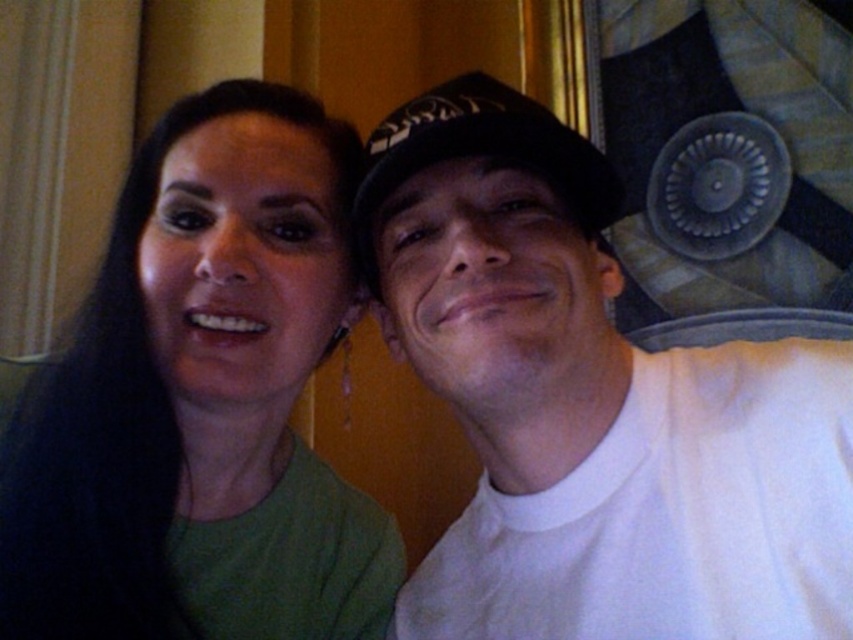
Question: Which of the following is the farthest from the observer?

Choices:
 (A) black fabric baseball hat at center
 (B) green matte shirt at left

Answer: (B)

Question: Is green matte shirt at left positioned at the back of black fabric baseball hat at center?

Choices:
 (A) no
 (B) yes

Answer: (B)

Question: Does green matte shirt at left have a larger size compared to black fabric baseball hat at center?

Choices:
 (A) yes
 (B) no

Answer: (A)

Question: Considering the relative positions of green matte shirt at left and black fabric baseball hat at center in the image provided, where is green matte shirt at left located with respect to black fabric baseball hat at center?

Choices:
 (A) right
 (B) left

Answer: (B)

Question: Which of the following is the closest to the observer?

Choices:
 (A) (178, 576)
 (B) (428, 138)

Answer: (B)

Question: Which point is closer to the camera?

Choices:
 (A) black fabric baseball hat at center
 (B) green matte shirt at left

Answer: (A)